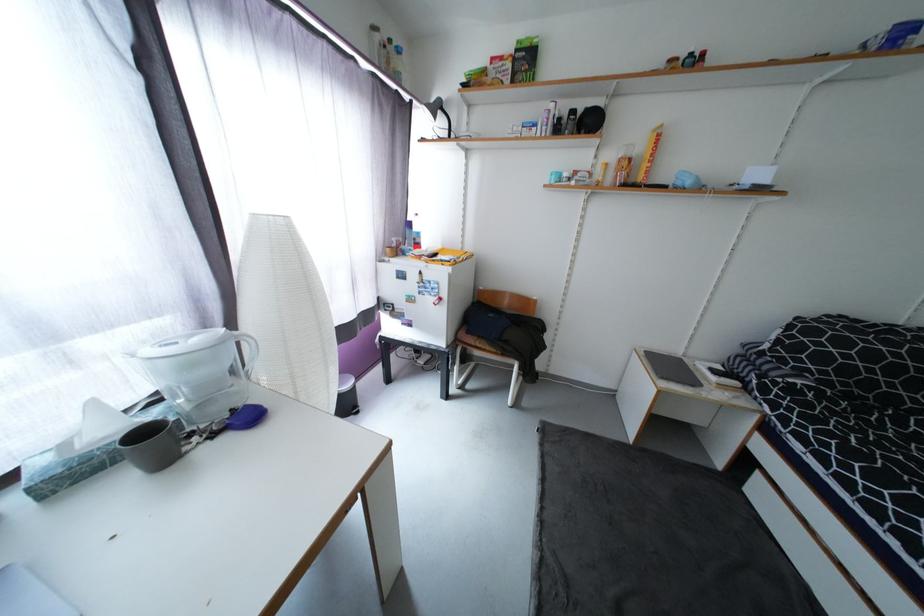
Find the location of a particular element. small blue cup is located at coordinates (152, 445).